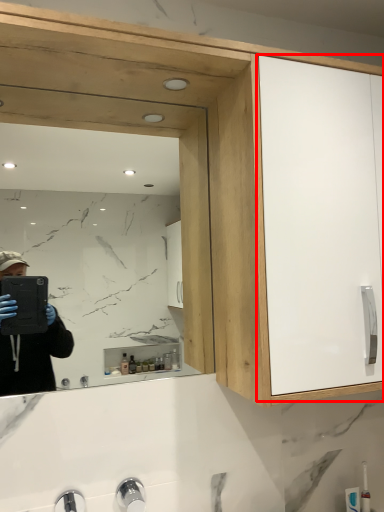
Question: From the image's perspective, what is the correct spatial relationship of glass door (annotated by the red box) in relation to mirror?

Choices:
 (A) below
 (B) above

Answer: (B)